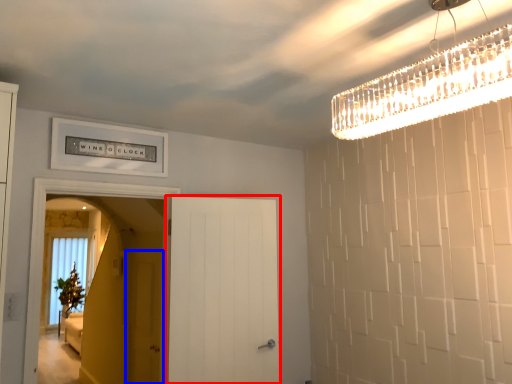
Question: Which object is closer to the camera taking this photo, door (highlighted by a red box) or screen door (highlighted by a blue box)?

Choices:
 (A) door
 (B) screen door

Answer: (A)